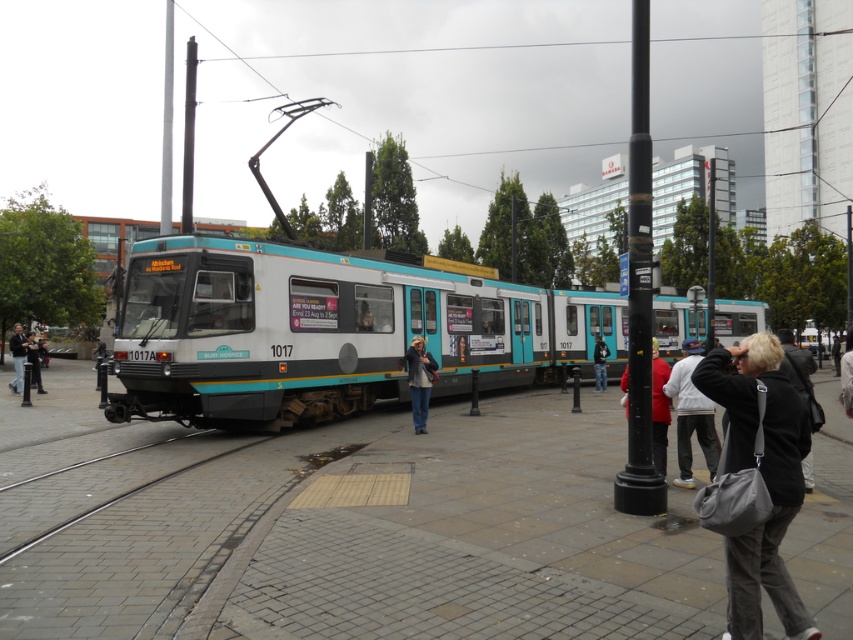
Question: Which object is farther from the camera taking this photo?

Choices:
 (A) black fabric bag at lower right
 (B) red fabric jacket at center

Answer: (B)

Question: From the image, what is the correct spatial relationship of black fabric bag at lower right in relation to white fleece jacket at center?

Choices:
 (A) above
 (B) below

Answer: (A)

Question: Is black fabric backpack at lower right below dark blue jeans at left?

Choices:
 (A) yes
 (B) no

Answer: (B)

Question: Does white fleece jacket at center appear on the left side of red fabric jacket at center?

Choices:
 (A) no
 (B) yes

Answer: (A)

Question: Which of the following is the closest to the observer?

Choices:
 (A) (712, 410)
 (B) (605, 371)
 (C) (778, 340)

Answer: (C)

Question: Considering the real-world distances, which object is closest to the teal matte train at center?

Choices:
 (A) black fabric backpack at lower right
 (B) jeans at center
 (C) dark blue jeans at center
 (D) black fabric bag at lower right

Answer: (B)